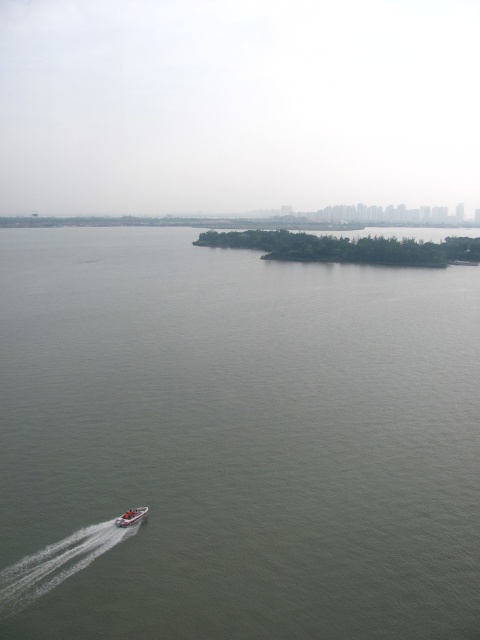
Does point (120, 426) come in front of point (123, 516)?

That is False.

Does green water at center have a smaller size compared to white plastic boat at lower left?

No, green water at center is not smaller than white plastic boat at lower left.

What do you see at coordinates (233, 442) in the screenshot?
I see `green water at center` at bounding box center [233, 442].

Where is `green water at center`? The image size is (480, 640). green water at center is located at coordinates (233, 442).